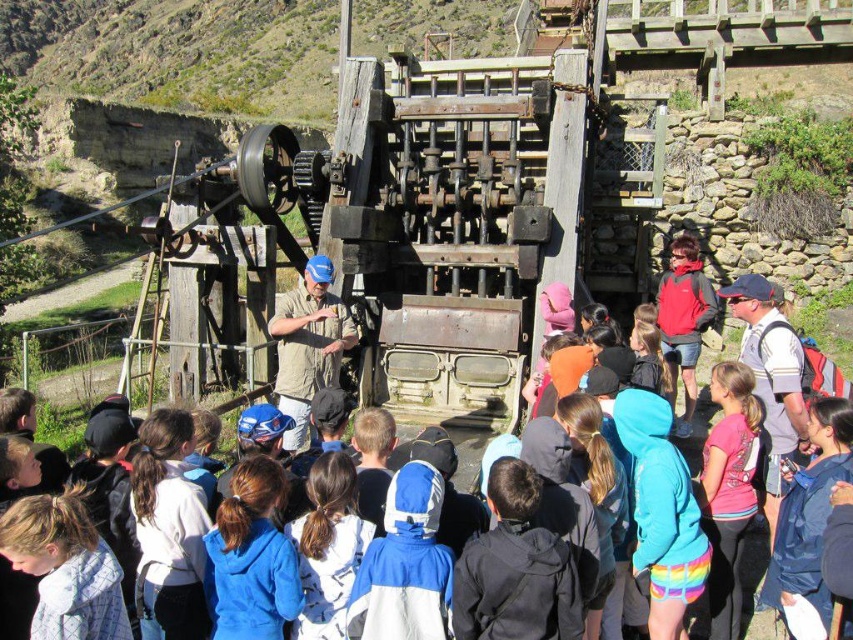
Question: Observing the image, what is the correct spatial positioning of pink fabric shirt at center in reference to white fabric at center?

Choices:
 (A) left
 (B) right

Answer: (B)

Question: Which is farther from the blue fleece jacket at lower center?

Choices:
 (A) white fabric at center
 (B) pink fabric shirt at center

Answer: (B)

Question: Which point is farther from the camera taking this photo?

Choices:
 (A) (277, 572)
 (B) (744, 444)

Answer: (B)

Question: Is blue fleece jacket at lower center closer to the viewer compared to pink fabric shirt at center?

Choices:
 (A) no
 (B) yes

Answer: (B)

Question: Is blue fleece jacket at lower center further to the viewer compared to pink fabric shirt at center?

Choices:
 (A) no
 (B) yes

Answer: (A)

Question: Which of these objects is positioned farthest from the white fabric at center?

Choices:
 (A) blue fleece jacket at lower center
 (B) pink fabric shirt at center

Answer: (B)